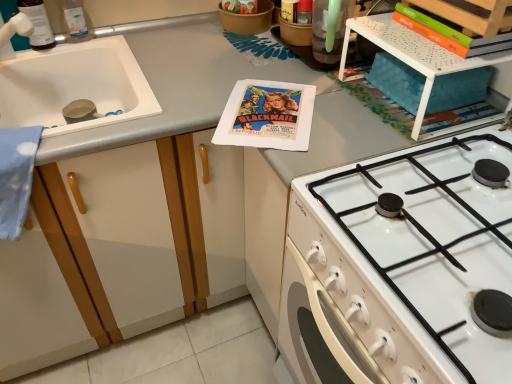
Question: Is white matte sink at left taller than translucent plastic bottle at upper left, which is the first bottle from left to right?

Choices:
 (A) no
 (B) yes

Answer: (A)

Question: Is white matte sink at left at the right side of translucent plastic bottle at upper left, the second bottle viewed from the right?

Choices:
 (A) no
 (B) yes

Answer: (B)

Question: From the image's perspective, is white matte sink at left located above translucent plastic bottle at upper left, the second bottle viewed from the right?

Choices:
 (A) yes
 (B) no

Answer: (B)

Question: Is white matte sink at left positioned beyond the bounds of translucent plastic bottle at upper left, the second bottle viewed from the right?

Choices:
 (A) no
 (B) yes

Answer: (B)

Question: From the image's perspective, is white matte sink at left beneath translucent plastic bottle at upper left, the second bottle viewed from the right?

Choices:
 (A) no
 (B) yes

Answer: (B)

Question: Based on their positions, is white perforated plastic shelf at upper right located to the left or right of white glossy gas stove at lower right?

Choices:
 (A) right
 (B) left

Answer: (B)

Question: Is point (393, 34) positioned closer to the camera than point (431, 279)?

Choices:
 (A) closer
 (B) farther

Answer: (B)

Question: From the image's perspective, is white perforated plastic shelf at upper right above or below white glossy gas stove at lower right?

Choices:
 (A) below
 (B) above

Answer: (B)

Question: Do you think white perforated plastic shelf at upper right is within white glossy gas stove at lower right, or outside of it?

Choices:
 (A) outside
 (B) inside

Answer: (A)

Question: Looking at their shapes, would you say clear plastic bottle at upper left, the 2th bottle from the left, is wider or thinner than white perforated plastic shelf at upper right?

Choices:
 (A) wide
 (B) thin

Answer: (B)

Question: From a real-world perspective, relative to white perforated plastic shelf at upper right, is clear plastic bottle at upper left, the 2th bottle from the left, vertically above or below?

Choices:
 (A) below
 (B) above

Answer: (B)

Question: Is clear plastic bottle at upper left, which is counted as the 1th bottle, starting from the right, in front of or behind white perforated plastic shelf at upper right in the image?

Choices:
 (A) front
 (B) behind

Answer: (B)

Question: Would you say clear plastic bottle at upper left, the 2th bottle from the left, is to the left or to the right of white perforated plastic shelf at upper right in the picture?

Choices:
 (A) left
 (B) right

Answer: (A)

Question: From the image's perspective, is translucent plastic bottle at upper left, which is the first bottle from left to right, above or below white perforated plastic shelf at upper right?

Choices:
 (A) above
 (B) below

Answer: (A)

Question: From a real-world perspective, is translucent plastic bottle at upper left, the second bottle viewed from the right, physically located above or below white perforated plastic shelf at upper right?

Choices:
 (A) below
 (B) above

Answer: (B)